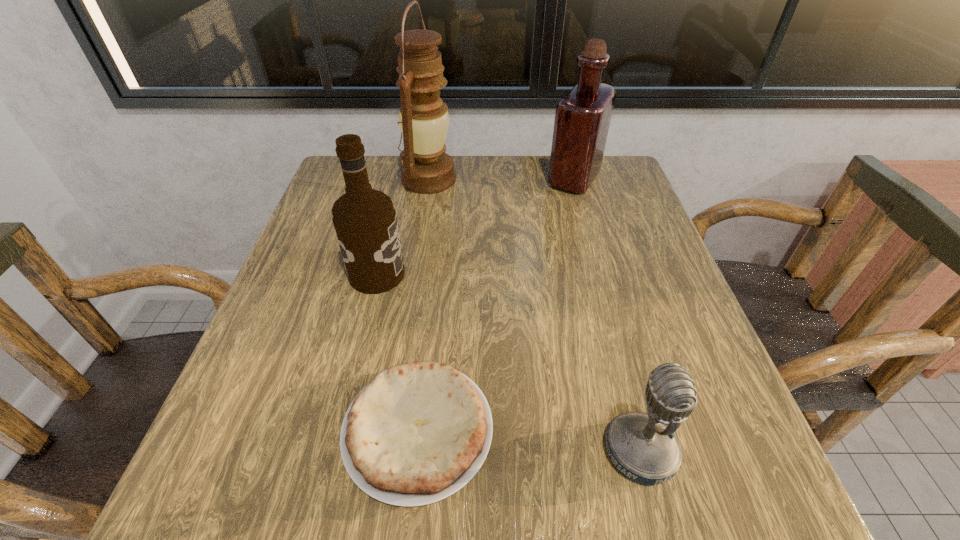
Locate an element on the screen. oil lamp is located at coordinates (423, 118).

The width and height of the screenshot is (960, 540). Find the location of `liquor`. liquor is located at coordinates (582, 119).

This screenshot has width=960, height=540. Identify the location of alcohol. (365, 221).

Where is `microphone`? microphone is located at coordinates (643, 447).

Locate an element on the screen. tortilla is located at coordinates (418, 432).

This screenshot has width=960, height=540. Identify the location of blank area located on the left of the tallest object. (350, 179).

Where is `free space located 0.280m on the left of the liquor`? Image resolution: width=960 pixels, height=540 pixels. free space located 0.280m on the left of the liquor is located at coordinates (434, 179).

At what (x,y) coordinates should I click in order to perform the action: click on vacant region located 0.190m on the label of the third farthest object. Please return your answer as a coordinate pair (x, y). Looking at the image, I should click on (502, 274).

Where is `vacant space located on the front-facing side of the microphone`? This screenshot has width=960, height=540. vacant space located on the front-facing side of the microphone is located at coordinates (372, 451).

Where is `free space located on the front-facing side of the microphone`? The image size is (960, 540). free space located on the front-facing side of the microphone is located at coordinates (539, 451).